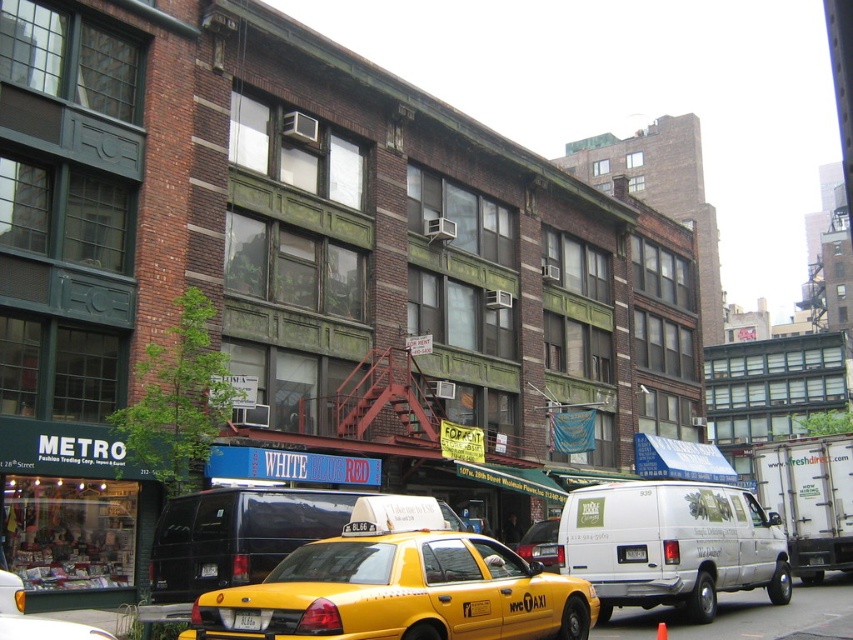
You are a delivery drone that needs to drop off a package to the yellow plastic license plate at center. The drone is currently hovering above the yellow matte taxi at center. Can the drone safely descend vertically to deliver the package without hitting any obstacles?

The distance between the yellow matte taxi at center and the yellow plastic license plate at center is 9.07 meters. Since the drone is hovering above the yellow matte taxi at center, it can safely descend vertically to the yellow plastic license plate at center as there are no obstacles mentioned in the scene description between them.

You are a photographer standing on the sidewalk and want to take a clear photo of the yellow plastic license plate at center without the yellow matte taxi at center blocking it. Is this possible?

The yellow matte taxi at center is in front of the yellow plastic license plate at center, so it will block the view. Move to a position where the taxi is no longer between you and the license plate.

You are a delivery driver who needs to park your vehicle in a tight space between the white matte van at center and the yellow rubber taxi cab at lower center. Based on their sizes, which vehicle should you avoid positioning closer to the space to ensure proper fitting?

The white matte van at center is larger in size than the yellow rubber taxi cab at lower center, so you should avoid positioning the white matte van at center closer to the space to ensure proper fitting.